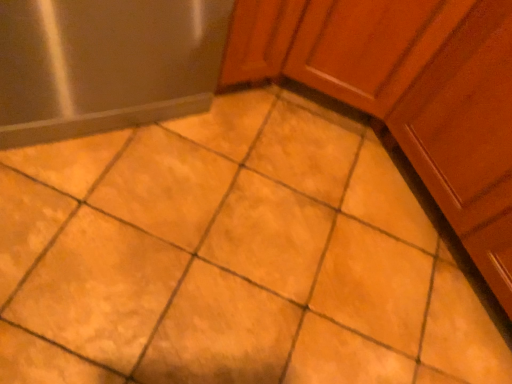
Describe the element at coordinates (440, 112) in the screenshot. The image size is (512, 384). I see `matte wood cabinet at upper right` at that location.

At what (x,y) coordinates should I click in order to perform the action: click on matte wood cabinet at upper right. Please return your answer as a coordinate pair (x, y). Looking at the image, I should click on (x=440, y=112).

What do you see at coordinates (105, 64) in the screenshot?
I see `satin silver refrigerator at left` at bounding box center [105, 64].

The height and width of the screenshot is (384, 512). I want to click on satin silver refrigerator at left, so click(x=105, y=64).

What is the approximate width of satin silver refrigerator at left?

22.16 inches.

Where is `matte wood cabinet at upper right`? matte wood cabinet at upper right is located at coordinates (440, 112).

Considering the relative positions of matte wood cabinet at upper right and satin silver refrigerator at left in the image provided, is matte wood cabinet at upper right to the left of satin silver refrigerator at left from the viewer's perspective?

Incorrect, matte wood cabinet at upper right is not on the left side of satin silver refrigerator at left.

Is the depth of matte wood cabinet at upper right greater than that of satin silver refrigerator at left?

No, matte wood cabinet at upper right is in front of satin silver refrigerator at left.

Which is less distant, (295,50) or (53,16)?

Clearly, point (295,50) is more distant from the camera than point (53,16).

From the image's perspective, is matte wood cabinet at upper right above or below satin silver refrigerator at left?

Based on their image positions, matte wood cabinet at upper right is located beneath satin silver refrigerator at left.

From a real-world perspective, is matte wood cabinet at upper right on satin silver refrigerator at left?

Yes, from a real-world perspective, matte wood cabinet at upper right is above satin silver refrigerator at left.

Which of these two, matte wood cabinet at upper right or satin silver refrigerator at left, is wider?

matte wood cabinet at upper right is wider.

Considering the relative sizes of matte wood cabinet at upper right and satin silver refrigerator at left in the image provided, is matte wood cabinet at upper right taller than satin silver refrigerator at left?

Yes, matte wood cabinet at upper right is taller than satin silver refrigerator at left.

Can you confirm if matte wood cabinet at upper right is smaller than satin silver refrigerator at left?

Actually, matte wood cabinet at upper right might be larger than satin silver refrigerator at left.

Is matte wood cabinet at upper right not within satin silver refrigerator at left?

Indeed, matte wood cabinet at upper right is completely outside satin silver refrigerator at left.

Would you consider matte wood cabinet at upper right to be distant from satin silver refrigerator at left?

No.

Could you tell me if matte wood cabinet at upper right is facing satin silver refrigerator at left?

Yes, matte wood cabinet at upper right is aimed at satin silver refrigerator at left.

How many degrees apart are the facing directions of matte wood cabinet at upper right and satin silver refrigerator at left?

89.5 degrees separate the facing orientations of matte wood cabinet at upper right and satin silver refrigerator at left.

Locate an element on the screen. Image resolution: width=512 pixels, height=384 pixels. appliance that is under the matte wood cabinet at upper right (from a real-world perspective) is located at coordinates (105, 64).

Is satin silver refrigerator at left at the left side of matte wood cabinet at upper right?

Yes, satin silver refrigerator at left is to the left of matte wood cabinet at upper right.

Considering the relative positions of satin silver refrigerator at left and matte wood cabinet at upper right in the image provided, is satin silver refrigerator at left behind matte wood cabinet at upper right?

That is True.

Is point (78, 100) closer or farther from the camera than point (493, 282)?

Point (78, 100) is positioned closer to the camera compared to point (493, 282).

From the image's perspective, which object appears higher, satin silver refrigerator at left or matte wood cabinet at upper right?

satin silver refrigerator at left appears higher in the image.

From a real-world perspective, is satin silver refrigerator at left positioned above or below matte wood cabinet at upper right?

In terms of real-world spatial position, satin silver refrigerator at left is below matte wood cabinet at upper right.

Is satin silver refrigerator at left wider or thinner than matte wood cabinet at upper right?

In the image, satin silver refrigerator at left appears to be more narrow than matte wood cabinet at upper right.

Is satin silver refrigerator at left taller or shorter than matte wood cabinet at upper right?

In the image, satin silver refrigerator at left appears to be shorter than matte wood cabinet at upper right.

In terms of size, does satin silver refrigerator at left appear bigger or smaller than matte wood cabinet at upper right?

In the image, satin silver refrigerator at left appears to be smaller than matte wood cabinet at upper right.

Based on the photo, is satin silver refrigerator at left inside the boundaries of matte wood cabinet at upper right, or outside?

satin silver refrigerator at left is spatially situated outside matte wood cabinet at upper right.

Is satin silver refrigerator at left placed right next to matte wood cabinet at upper right?

satin silver refrigerator at left and matte wood cabinet at upper right are not in contact.

Is satin silver refrigerator at left oriented away from matte wood cabinet at upper right?

No.

Measure the distance from satin silver refrigerator at left to matte wood cabinet at upper right.

satin silver refrigerator at left is 14.80 inches from matte wood cabinet at upper right.

Where is `cabinetry that is below the satin silver refrigerator at left (from the image's perspective)`? cabinetry that is below the satin silver refrigerator at left (from the image's perspective) is located at coordinates (440, 112).

I want to click on appliance located on the left of matte wood cabinet at upper right, so click(x=105, y=64).

The width and height of the screenshot is (512, 384). What are the coordinates of `cabinetry on the right of satin silver refrigerator at left` in the screenshot? It's located at (440, 112).